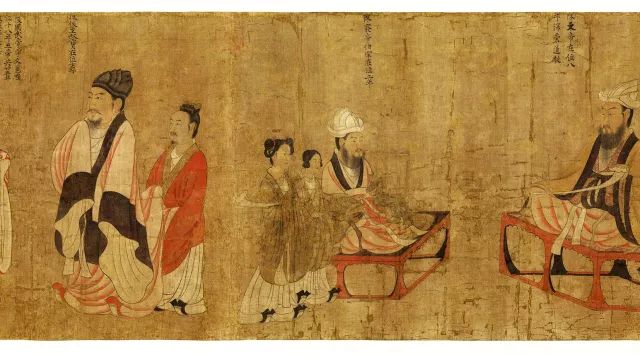
I want to click on sitting area on left, so [x=345, y=259], [x=445, y=216].